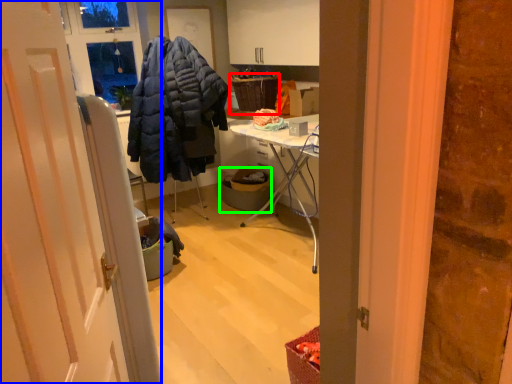
Question: Which object is positioned closest to picnic basket (highlighted by a red box)? Select from door (highlighted by a blue box) and trash bin/can (highlighted by a green box).

Choices:
 (A) door
 (B) trash bin/can

Answer: (B)